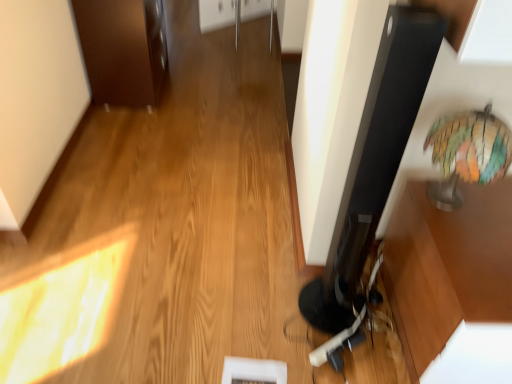
The width and height of the screenshot is (512, 384). Describe the element at coordinates (467, 153) in the screenshot. I see `multicolored glass globe at right` at that location.

Locate an element on the screen. This screenshot has height=384, width=512. multicolored glass globe at right is located at coordinates tap(467, 153).

What is the approximate height of multicolored glass globe at right?

multicolored glass globe at right is 36.55 centimeters tall.

What do you see at coordinates (123, 49) in the screenshot? This screenshot has height=384, width=512. I see `brown wood cabinet at upper left` at bounding box center [123, 49].

The image size is (512, 384). Identify the location of brown wood cabinet at upper left. (123, 49).

Find the location of a particular element. This screenshot has height=384, width=512. multicolored glass globe at right is located at coordinates (467, 153).

In the scene shown: Which object is positioned more to the left, multicolored glass globe at right or brown wood cabinet at upper left?

From the viewer's perspective, brown wood cabinet at upper left appears more on the left side.

Is multicolored glass globe at right positioned in front of brown wood cabinet at upper left?

Yes, it is.

Which point is more forward, (475, 111) or (94, 90)?

The point (475, 111) is closer.

From the image's perspective, relative to brown wood cabinet at upper left, is multicolored glass globe at right above or below?

multicolored glass globe at right is below brown wood cabinet at upper left.

From a real-world perspective, which object rests below the other?

From a 3D spatial view, brown wood cabinet at upper left is below.

Can you confirm if multicolored glass globe at right is thinner than brown wood cabinet at upper left?

Correct, the width of multicolored glass globe at right is less than that of brown wood cabinet at upper left.

Can you confirm if multicolored glass globe at right is shorter than brown wood cabinet at upper left?

Indeed, multicolored glass globe at right has a lesser height compared to brown wood cabinet at upper left.

Which of these two, multicolored glass globe at right or brown wood cabinet at upper left, is bigger?

Bigger between the two is brown wood cabinet at upper left.

Does multicolored glass globe at right contain brown wood cabinet at upper left?

No, brown wood cabinet at upper left is not surrounded by multicolored glass globe at right.

Is multicolored glass globe at right with brown wood cabinet at upper left?

They are not placed beside each other.

Could you tell me if multicolored glass globe at right is facing brown wood cabinet at upper left?

No, multicolored glass globe at right is not turned towards brown wood cabinet at upper left.

Identify the location of table lamp below the brown wood cabinet at upper left (from the image's perspective). This screenshot has height=384, width=512. (467, 153).

Is brown wood cabinet at upper left at the right side of multicolored glass globe at right?

No, brown wood cabinet at upper left is not to the right of multicolored glass globe at right.

Considering the positions of objects brown wood cabinet at upper left and multicolored glass globe at right in the image provided, who is behind, brown wood cabinet at upper left or multicolored glass globe at right?

brown wood cabinet at upper left.

Which point is more distant from viewer, [129,0] or [485,132]?

The point [129,0] is farther.

In the scene shown: From the image's perspective, which one is positioned lower, brown wood cabinet at upper left or multicolored glass globe at right?

multicolored glass globe at right is shown below in the image.

From a real-world perspective, is brown wood cabinet at upper left located beneath multicolored glass globe at right?

Yes, from a real-world perspective, brown wood cabinet at upper left is beneath multicolored glass globe at right.

Between brown wood cabinet at upper left and multicolored glass globe at right, which one has larger width?

Wider between the two is brown wood cabinet at upper left.

In terms of height, does brown wood cabinet at upper left look taller or shorter compared to multicolored glass globe at right?

In the image, brown wood cabinet at upper left appears to be taller than multicolored glass globe at right.

Does brown wood cabinet at upper left have a larger size compared to multicolored glass globe at right?

Yes.

Is brown wood cabinet at upper left not within multicolored glass globe at right?

brown wood cabinet at upper left is positioned outside multicolored glass globe at right.

Is brown wood cabinet at upper left far from multicolored glass globe at right?

Yes, brown wood cabinet at upper left and multicolored glass globe at right are quite far apart.

Is brown wood cabinet at upper left facing away from multicolored glass globe at right?

brown wood cabinet at upper left does not have its back to multicolored glass globe at right.

How different are the orientations of brown wood cabinet at upper left and multicolored glass globe at right in degrees?

The facing directions of brown wood cabinet at upper left and multicolored glass globe at right are 92.4 degrees apart.

Locate an element on the screen. This screenshot has height=384, width=512. cabinetry lying above the multicolored glass globe at right (from the image's perspective) is located at coordinates (123, 49).

The image size is (512, 384). I want to click on cabinetry lying on the left of multicolored glass globe at right, so click(123, 49).

Image resolution: width=512 pixels, height=384 pixels. What are the coordinates of `cabinetry that is above the multicolored glass globe at right (from the image's perspective)` in the screenshot? It's located at (123, 49).